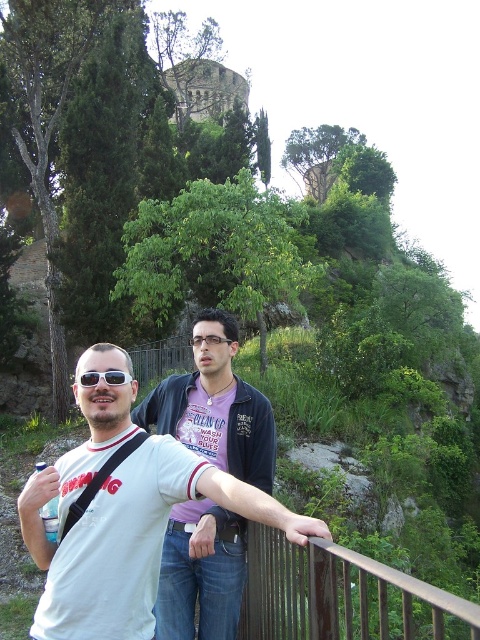
Question: Which object appears farthest from the camera in this image?

Choices:
 (A) sunglasses at center
 (B) white matte t-shirt at center
 (C) rusty metal rail at lower center

Answer: (A)

Question: Which point appears closest to the camera in this image?

Choices:
 (A) (214, 563)
 (B) (115, 371)
 (C) (113, 625)

Answer: (C)

Question: Which of the following is the closest to the observer?

Choices:
 (A) sunglasses at center
 (B) white matte t-shirt at center

Answer: (B)

Question: Where is white matte t-shirt at center located in relation to rusty metal rail at lower center in the image?

Choices:
 (A) right
 (B) left

Answer: (B)

Question: Is purple cotton shirt at center smaller than rusty metal rail at lower center?

Choices:
 (A) no
 (B) yes

Answer: (B)

Question: Is purple cotton shirt at center above rusty metal rail at lower center?

Choices:
 (A) yes
 (B) no

Answer: (A)